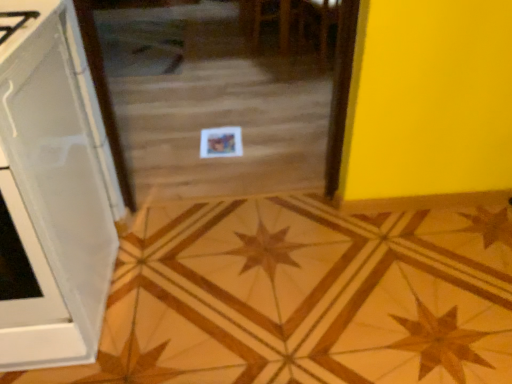
Identify the location of vacant area on top of wooden star at center (from a real-world perspective). (313, 267).